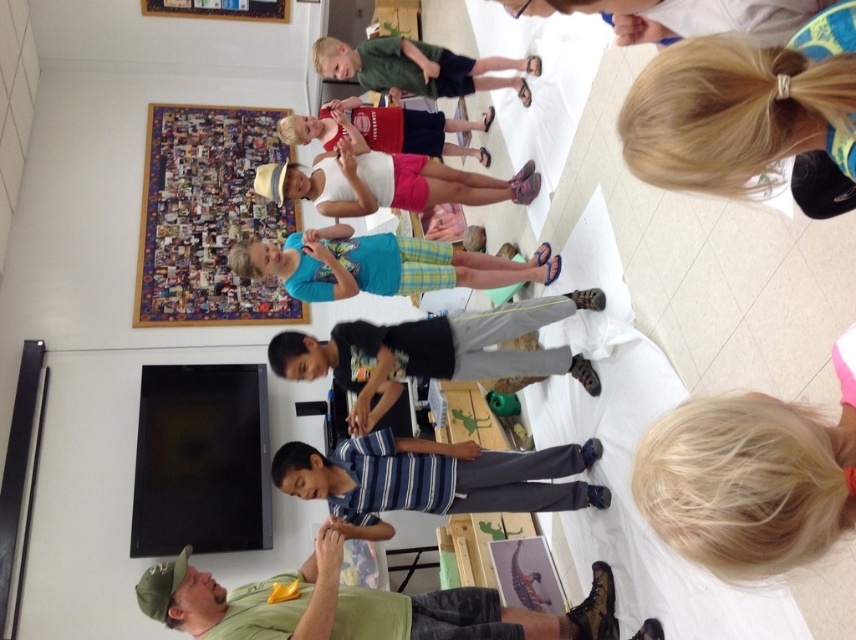
Does blue striped shirt at center have a smaller size compared to matte red shirt at center?

Correct, blue striped shirt at center occupies less space than matte red shirt at center.

The height and width of the screenshot is (640, 856). What do you see at coordinates (432, 477) in the screenshot?
I see `blue striped shirt at center` at bounding box center [432, 477].

Where is `blue striped shirt at center`? blue striped shirt at center is located at coordinates (432, 477).

Who is higher up, white matte tank top at center or matte red shirt at center?

matte red shirt at center is higher up.

Is white matte tank top at center wider than matte red shirt at center?

Indeed, white matte tank top at center has a greater width compared to matte red shirt at center.

Where is `white matte tank top at center`? white matte tank top at center is located at coordinates (387, 182).

Can you confirm if blue striped shirt at center is positioned above black cotton shirt at center?

Actually, blue striped shirt at center is below black cotton shirt at center.

Is blue striped shirt at center to the left of black cotton shirt at center from the viewer's perspective?

No, blue striped shirt at center is not to the left of black cotton shirt at center.

Is point (394, 465) positioned behind point (586, 296)?

No, it is not.

Where is `blue striped shirt at center`? The image size is (856, 640). blue striped shirt at center is located at coordinates (432, 477).